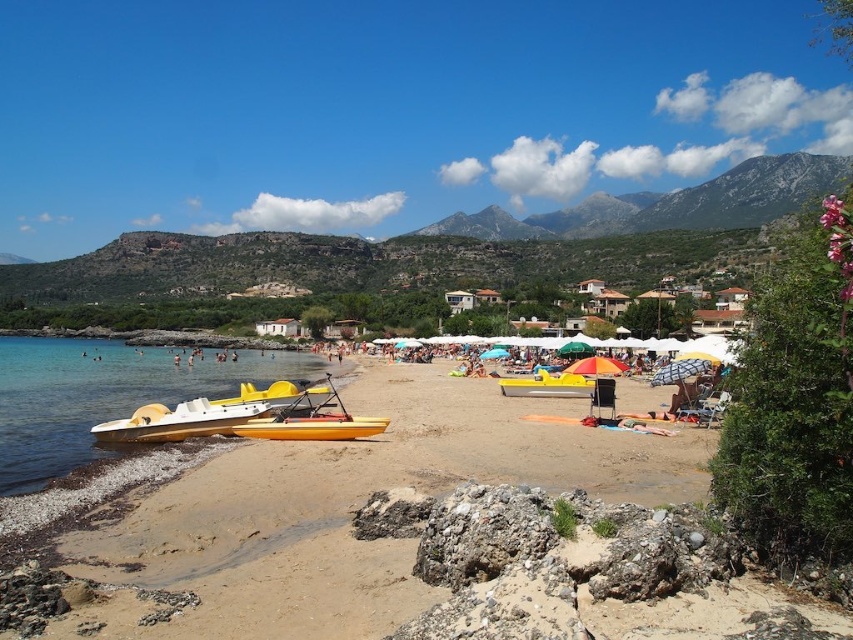
Question: Which object is positioned closest to the yellow matte kayak at lower left?

Choices:
 (A) yellow plastic boat at center
 (B) yellow matte kayak at lower center

Answer: (B)

Question: Based on their relative distances, which object is nearer to the yellow plastic boat at center?

Choices:
 (A) yellow matte kayak at lower center
 (B) yellow plastic watercraft at lower left

Answer: (A)

Question: Does yellow sand at lower left have a smaller size compared to yellow plastic watercraft at lower left?

Choices:
 (A) yes
 (B) no

Answer: (A)

Question: Is yellow matte kayak at lower center in front of yellow plastic boat at center?

Choices:
 (A) yes
 (B) no

Answer: (A)

Question: Estimate the real-world distances between objects in this image. Which object is closer to the yellow matte kayak at lower left?

Choices:
 (A) yellow plastic watercraft at lower left
 (B) yellow matte kayak at lower center

Answer: (B)

Question: Is yellow sand at lower left further to the viewer compared to yellow matte kayak at lower left?

Choices:
 (A) yes
 (B) no

Answer: (B)